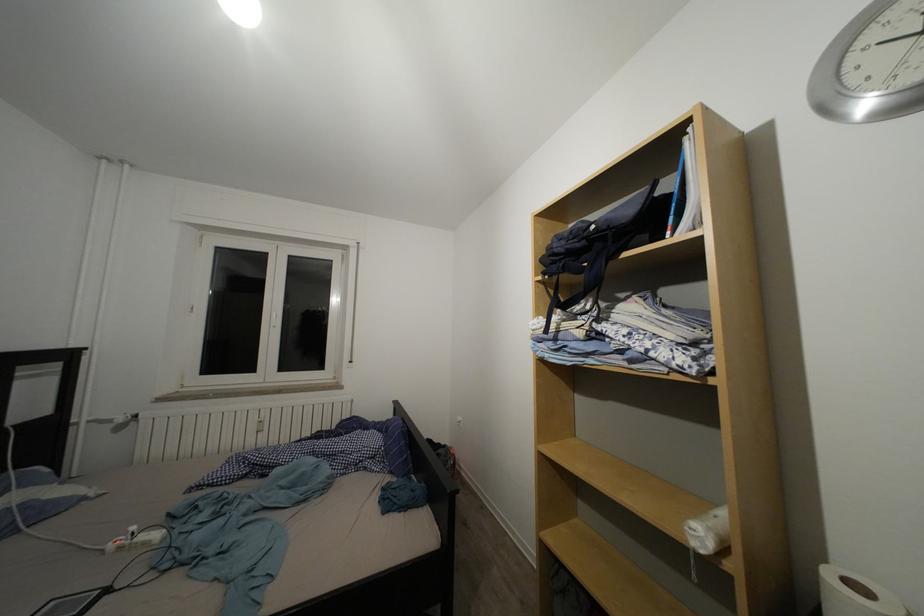
Locate an element on the screen. white window handle is located at coordinates (275, 314).